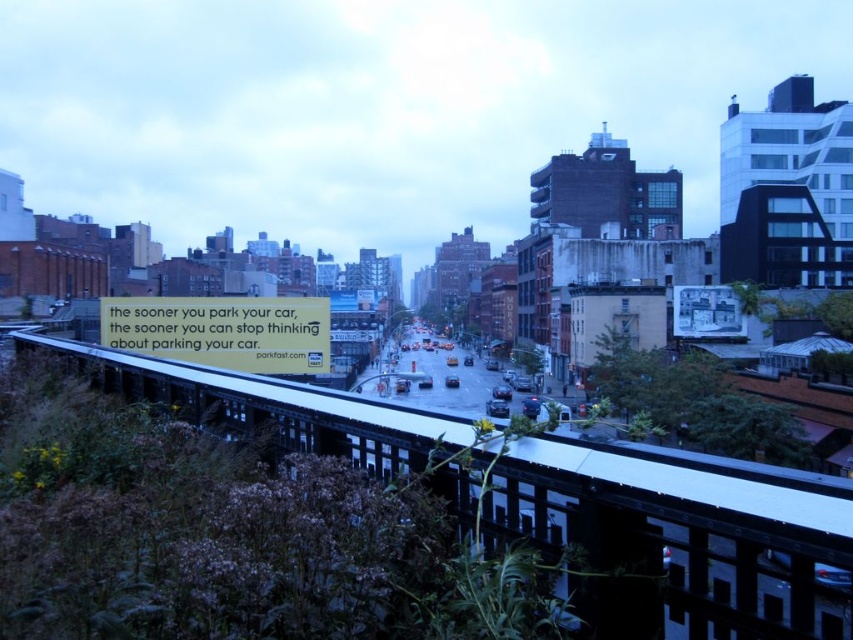
Can you confirm if black metal train track at center is smaller than yellow paper sign at center?

Actually, black metal train track at center might be larger than yellow paper sign at center.

Which of these two, black metal train track at center or yellow paper sign at center, stands taller?

Standing taller between the two is yellow paper sign at center.

Is point (747, 541) closer to camera compared to point (195, 317)?

Yes, point (747, 541) is in front of point (195, 317).

What are the coordinates of `black metal train track at center` in the screenshot? It's located at (685, 536).